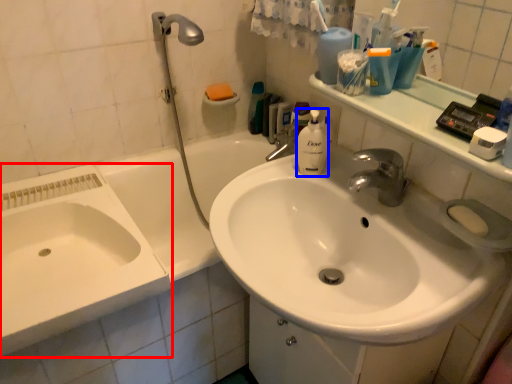
Question: Which point is closer to the camera, sink (highlighted by a red box) or cleaning product (highlighted by a blue box)?

Choices:
 (A) sink
 (B) cleaning product

Answer: (A)